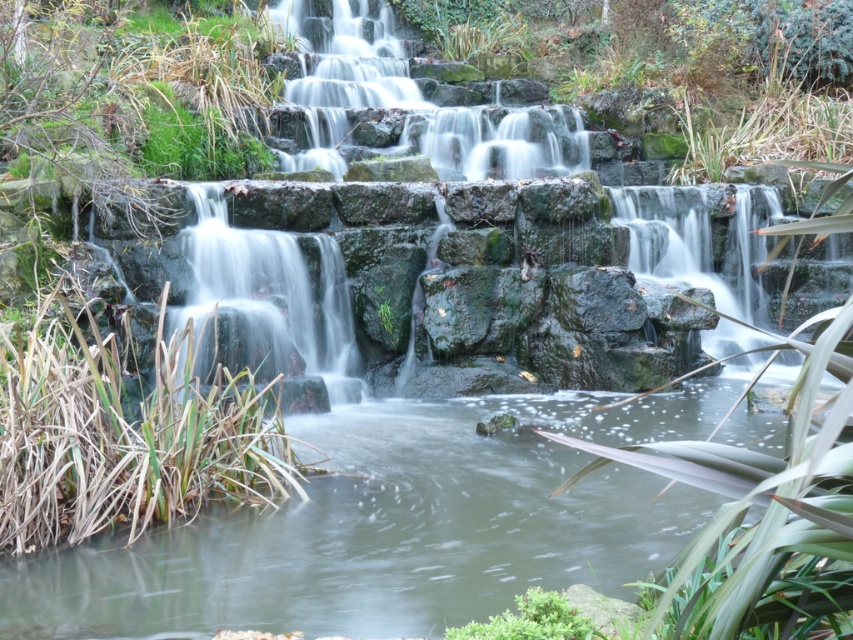
In order to click on clear water at center in this screenshot , I will do `click(393, 525)`.

Can you confirm if clear water at center is positioned below green mossy rock at upper center?

Indeed, clear water at center is positioned under green mossy rock at upper center.

Which is behind, point (239, 573) or point (569, 116)?

Point (569, 116)

The height and width of the screenshot is (640, 853). Identify the location of clear water at center. (393, 525).